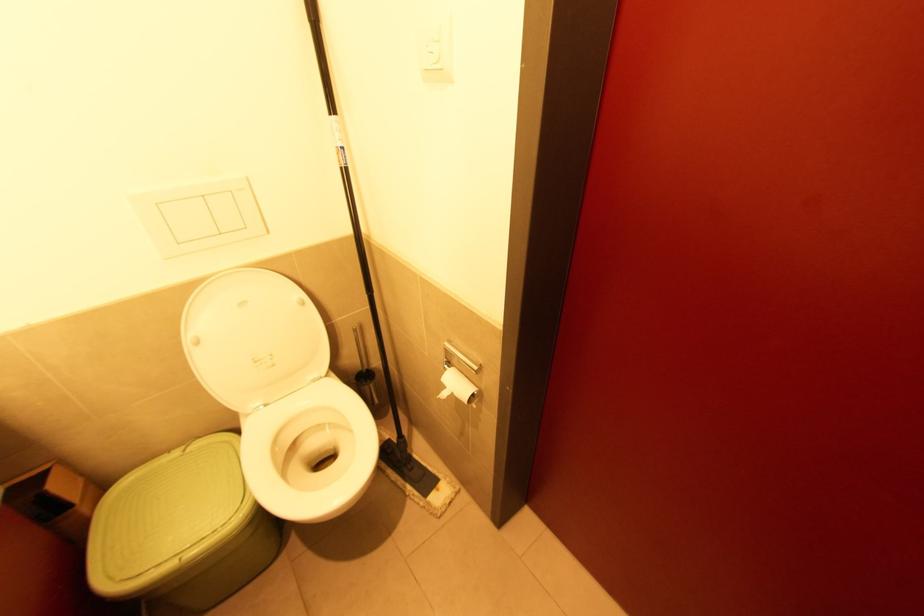
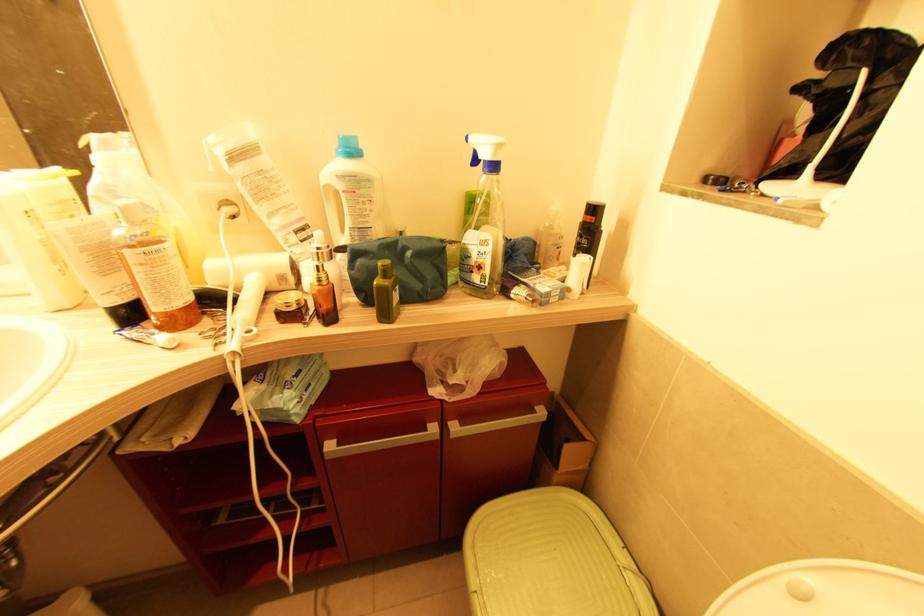
The point at (187,452) is marked in the first image. Where is the corresponding point in the second image?

(626, 570)